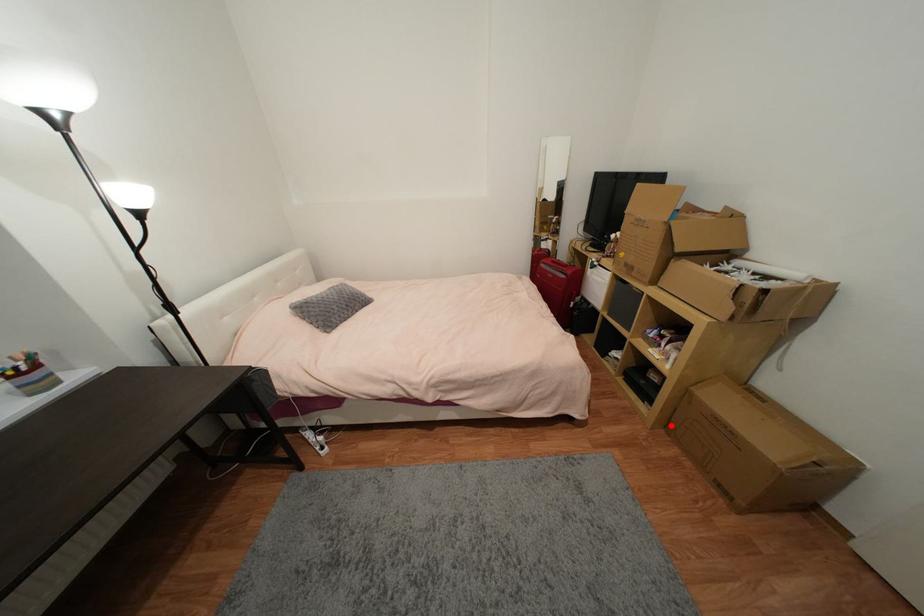
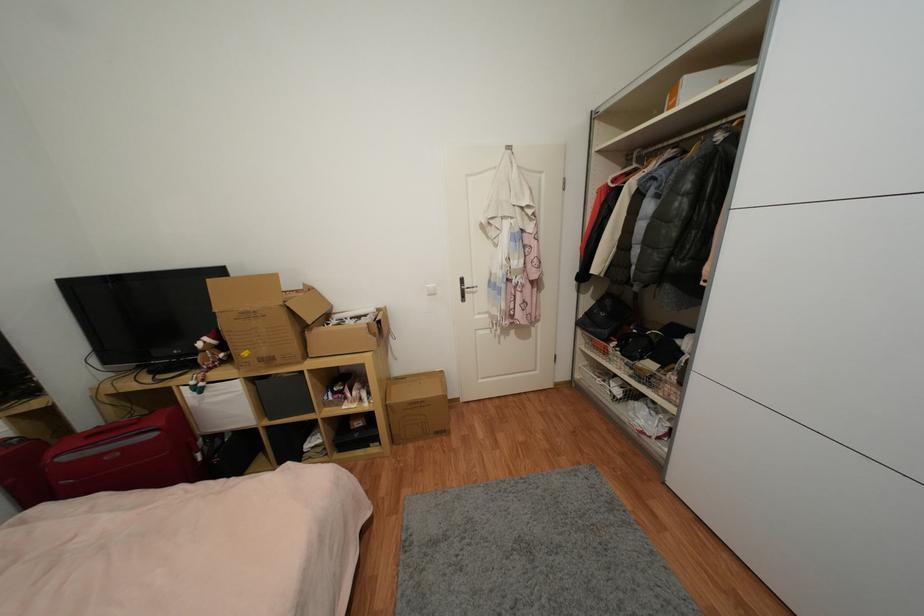
Find the pixel in the second image that matches the highlighted location in the first image.

(397, 440)